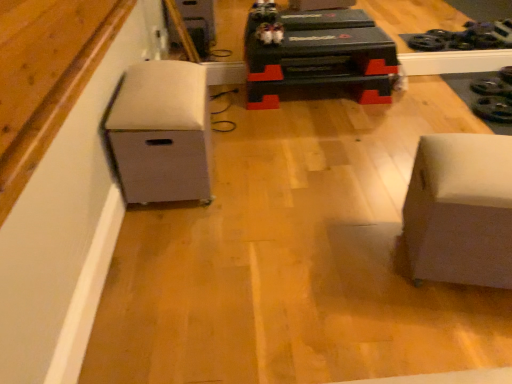
Image resolution: width=512 pixels, height=384 pixels. Identify the location of white fabric storage bin at left, the 1th furniture from the left. (161, 133).

Which of these two, white fabric storage bin at left, the 1th furniture from the left, or white matte wood at lower left, is smaller?

With smaller size is white matte wood at lower left.

Is white fabric storage bin at left, which is the second furniture from right to left, with white matte wood at lower left?

white fabric storage bin at left, which is the second furniture from right to left, and white matte wood at lower left are clearly separated.

Could you tell me if white fabric storage bin at left, the 1th furniture from the left, is turned towards white matte wood at lower left?

No, white fabric storage bin at left, the 1th furniture from the left, is not facing towards white matte wood at lower left.

Between white fabric storage bin at left, the 1th furniture from the left, and white matte wood at lower left, which one appears on the right side from the viewer's perspective?

white fabric storage bin at left, the 1th furniture from the left, is more to the right.

Which object is wider, white matte wood at lower left or white fabric storage bin at left, which is the second furniture from right to left?

white fabric storage bin at left, which is the second furniture from right to left, is wider.

Is white matte wood at lower left in front of or behind white fabric storage bin at left, which is the second furniture from right to left, in the image?

white matte wood at lower left is in front of white fabric storage bin at left, which is the second furniture from right to left.

Is point (6, 148) positioned after point (119, 182)?

No.

This screenshot has height=384, width=512. I want to click on the 1st furniture positioned below the white matte wood at lower left (from a real-world perspective), so click(161, 133).

Between white matte ottoman at right, the 2th furniture from the left, and white matte wood at lower left, which one is positioned in front?

Positioned in front is white matte wood at lower left.

Considering the relative sizes of white matte ottoman at right, acting as the 1th furniture starting from the right, and white matte wood at lower left in the image provided, is white matte ottoman at right, acting as the 1th furniture starting from the right, wider than white matte wood at lower left?

Yes.

Does point (500, 270) come farther from viewer compared to point (110, 29)?

No, it is in front of (110, 29).

Are white matte wood at lower left and white matte ottoman at right, acting as the 1th furniture starting from the right, beside each other?

There is a gap between white matte wood at lower left and white matte ottoman at right, acting as the 1th furniture starting from the right.

Is white matte wood at lower left oriented towards white matte ottoman at right, acting as the 1th furniture starting from the right?

No, white matte wood at lower left does not turn towards white matte ottoman at right, acting as the 1th furniture starting from the right.

From a real-world perspective, between white matte wood at lower left and white matte ottoman at right, acting as the 1th furniture starting from the right, who is vertically higher?

In real-world perspective, white matte wood at lower left is above.

Who is smaller, white fabric storage bin at left, which is the second furniture from right to left, or white matte ottoman at right, acting as the 1th furniture starting from the right?

With smaller size is white matte ottoman at right, acting as the 1th furniture starting from the right.

From a real-world perspective, is white fabric storage bin at left, which is the second furniture from right to left, on white matte ottoman at right, acting as the 1th furniture starting from the right?

Yes, from a real-world perspective, white fabric storage bin at left, which is the second furniture from right to left, is above white matte ottoman at right, acting as the 1th furniture starting from the right.

Is white fabric storage bin at left, which is the second furniture from right to left, completely or partially outside of white matte ottoman at right, the 2th furniture from the left?

That's correct, white fabric storage bin at left, which is the second furniture from right to left, is outside of white matte ottoman at right, the 2th furniture from the left.

Based on the photo, which object is further away from the camera taking this photo, white fabric storage bin at left, the 1th furniture from the left, or white matte ottoman at right, acting as the 1th furniture starting from the right?

white fabric storage bin at left, the 1th furniture from the left, is more distant.

Who is more distant, white matte ottoman at right, the 2th furniture from the left, or white fabric storage bin at left, which is the second furniture from right to left?

Positioned behind is white fabric storage bin at left, which is the second furniture from right to left.

From the image's perspective, is white matte ottoman at right, the 2th furniture from the left, above white fabric storage bin at left, which is the second furniture from right to left?

Actually, white matte ottoman at right, the 2th furniture from the left, appears below white fabric storage bin at left, which is the second furniture from right to left, in the image.

Is white matte ottoman at right, acting as the 1th furniture starting from the right, positioned with its back to white fabric storage bin at left, the 1th furniture from the left?

No, white matte ottoman at right, acting as the 1th furniture starting from the right,'s orientation is not away from white fabric storage bin at left, the 1th furniture from the left.

Locate an element on the screen. furniture that is the 2nd object located behind the white matte wood at lower left is located at coordinates (161, 133).

You are a GUI agent. You are given a task and a screenshot of the screen. Output one action in this format:
    pyautogui.click(x=<x>, y=<y>)
    Task: Click on the furniture that is the 1st object to the right of the white matte wood at lower left, starting at the anchor
    
    Given the screenshot: What is the action you would take?
    pyautogui.click(x=161, y=133)

Estimate the real-world distances between objects in this image. Which object is further from white matte ottoman at right, the 2th furniture from the left, white fabric storage bin at left, which is the second furniture from right to left, or white matte wood at lower left?

white matte wood at lower left.

From the image, which object appears to be nearer to white fabric storage bin at left, which is the second furniture from right to left, white matte wood at lower left or white matte ottoman at right, the 2th furniture from the left?

Based on the image, white matte wood at lower left appears to be nearer to white fabric storage bin at left, which is the second furniture from right to left.

Looking at the image, which one is located further to white matte ottoman at right, the 2th furniture from the left, white matte wood at lower left or white fabric storage bin at left, which is the second furniture from right to left?

white matte wood at lower left is positioned further to the anchor white matte ottoman at right, the 2th furniture from the left.

Based on their spatial positions, is white matte ottoman at right, the 2th furniture from the left, or white fabric storage bin at left, which is the second furniture from right to left, closer to white matte wood at lower left?

white fabric storage bin at left, which is the second furniture from right to left, is positioned closer to the anchor white matte wood at lower left.

Based on their spatial positions, is white fabric storage bin at left, the 1th furniture from the left, or white matte ottoman at right, acting as the 1th furniture starting from the right, closer to white matte wood at lower left?

white fabric storage bin at left, the 1th furniture from the left, is positioned closer to the anchor white matte wood at lower left.

From the picture: Estimate the real-world distances between objects in this image. Which object is closer to white fabric storage bin at left, which is the second furniture from right to left, white matte ottoman at right, the 2th furniture from the left, or white matte wood at lower left?

white matte wood at lower left is positioned closer to the anchor white fabric storage bin at left, which is the second furniture from right to left.

Locate an element on the screen. The width and height of the screenshot is (512, 384). furniture between white matte wood at lower left and white matte ottoman at right, acting as the 1th furniture starting from the right is located at coordinates (161, 133).